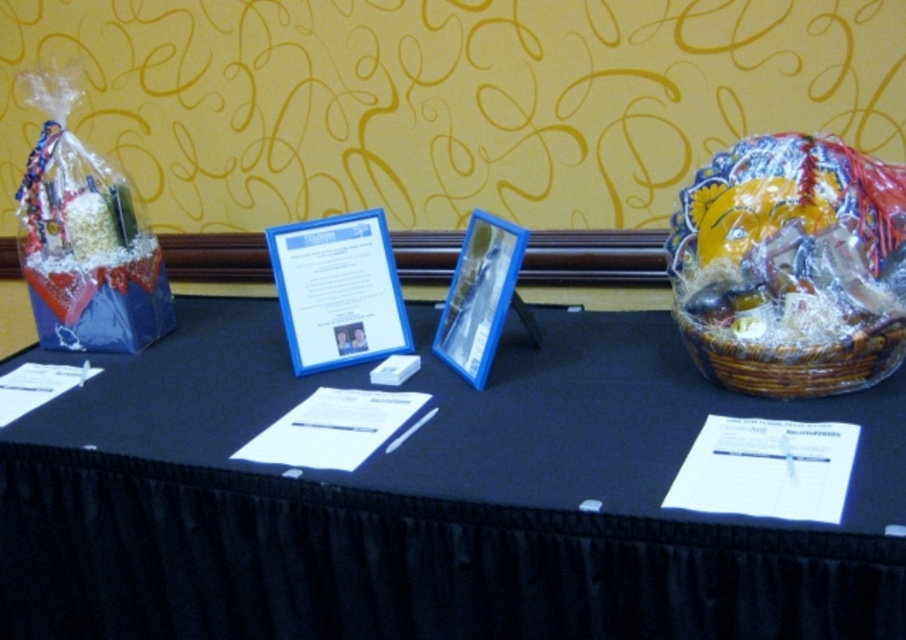
Where is `clear plastic frame at center`? clear plastic frame at center is located at coordinates (442, 112).

Between clear plastic frame at center and woven brown basket at right, which one is positioned higher?

clear plastic frame at center is higher up.

You are a GUI agent. You are given a task and a screenshot of the screen. Output one action in this format:
    pyautogui.click(x=<x>, y=<y>)
    Task: Click on the clear plastic frame at center
    
    Given the screenshot: What is the action you would take?
    pyautogui.click(x=442, y=112)

Which is in front, point (201, 579) or point (683, 36)?

Point (201, 579) is more forward.

Which of these two, black fabric table at center or clear plastic frame at center, stands shorter?

With less height is black fabric table at center.

Between point (69, 419) and point (410, 6), which one is positioned behind?

The point (410, 6) is behind.

Image resolution: width=906 pixels, height=640 pixels. I want to click on black fabric table at center, so click(429, 500).

Is point (567, 424) closer to viewer compared to point (776, 380)?

No, it is not.

In order to click on black fabric table at center in this screenshot , I will do `click(429, 500)`.